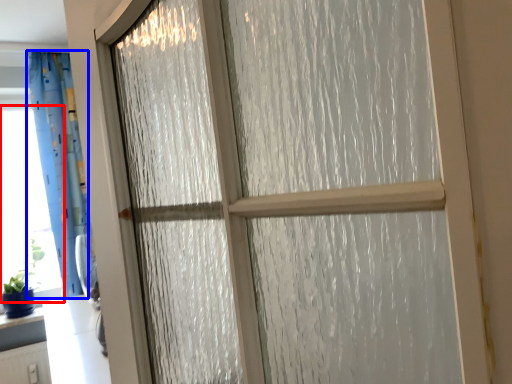
Question: Which object is closer to the camera taking this photo, window screen (highlighted by a red box) or curtain (highlighted by a blue box)?

Choices:
 (A) window screen
 (B) curtain

Answer: (B)